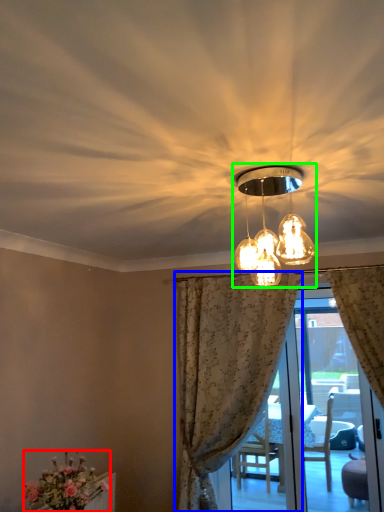
Question: Which object is the farthest from flower (highlighted by a red box)? Choose among these: curtain (highlighted by a blue box) or lamp (highlighted by a green box).

Choices:
 (A) curtain
 (B) lamp

Answer: (B)